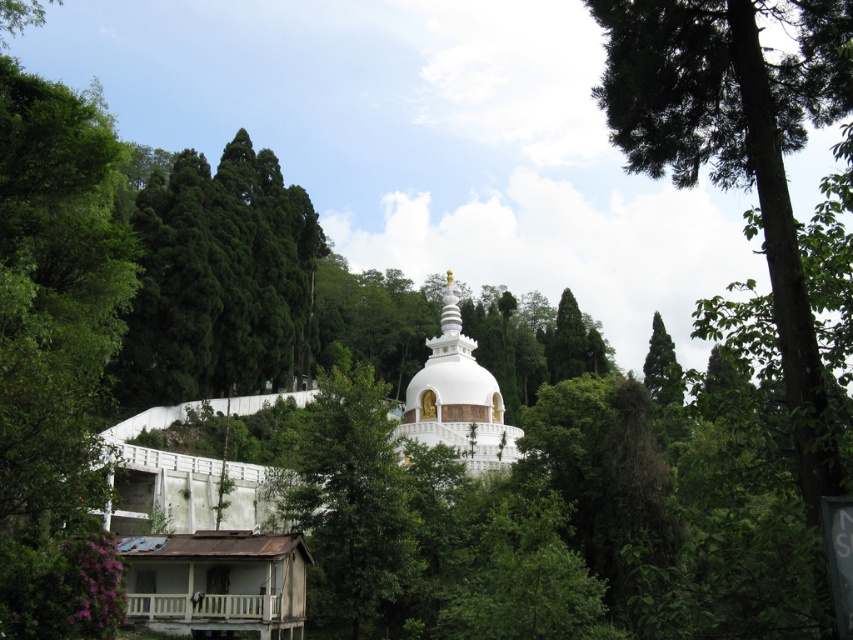
Question: Can you confirm if green leafy tree at upper center is wider than white glossy stupa at center?

Choices:
 (A) yes
 (B) no

Answer: (B)

Question: Which point is closer to the camera?

Choices:
 (A) green leafy tree at upper center
 (B) green leafy tree at upper right
 (C) green leafy tree at center

Answer: (A)

Question: Does green glossy tree at upper left have a larger size compared to green leafy tree at upper right?

Choices:
 (A) yes
 (B) no

Answer: (B)

Question: Does green leafy tree at center appear on the left side of white glossy stupa at center?

Choices:
 (A) yes
 (B) no

Answer: (A)

Question: Which point is farther from the camera taking this photo?

Choices:
 (A) (828, 108)
 (B) (123, 390)

Answer: (B)

Question: Which point is farther to the camera?

Choices:
 (A) (363, 435)
 (B) (490, 456)

Answer: (B)